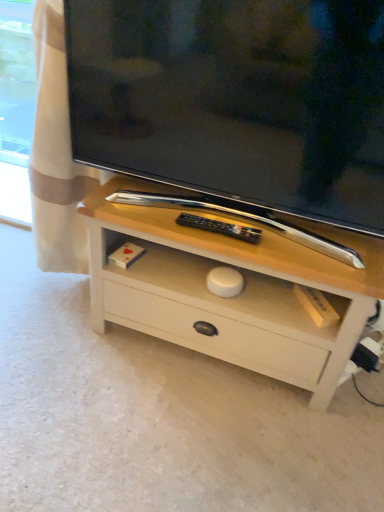
Locate an element on the screen. matte black tv at center is located at coordinates (236, 100).

In order to face matte black tv at center, should I rotate leftwards or rightwards?

To align with it, rotate right about 5.014°.

This screenshot has height=512, width=384. Describe the element at coordinates (236, 100) in the screenshot. I see `matte black tv at center` at that location.

Find the location of a particular element. This screenshot has width=384, height=512. white painted wood chest of drawers at center is located at coordinates (231, 298).

Describe the element at coordinates (231, 298) in the screenshot. I see `white painted wood chest of drawers at center` at that location.

Locate an element on the screen. matte black tv at center is located at coordinates (236, 100).

Which is more to the left, white painted wood chest of drawers at center or matte black tv at center?

matte black tv at center is more to the left.

Does white painted wood chest of drawers at center come behind matte black tv at center?

Yes, white painted wood chest of drawers at center is behind matte black tv at center.

Which point is more distant from viewer, (x=119, y=226) or (x=283, y=56)?

The point (x=119, y=226) is more distant.

From the image's perspective, is white painted wood chest of drawers at center below matte black tv at center?

Yes, from the image's perspective, white painted wood chest of drawers at center is below matte black tv at center.

From a real-world perspective, which is physically above, white painted wood chest of drawers at center or matte black tv at center?

In real-world perspective, matte black tv at center is above.

Can you confirm if white painted wood chest of drawers at center is thinner than matte black tv at center?

No, white painted wood chest of drawers at center is not thinner than matte black tv at center.

Between white painted wood chest of drawers at center and matte black tv at center, which one has less height?

white painted wood chest of drawers at center.

From the picture: Is white painted wood chest of drawers at center bigger or smaller than matte black tv at center?

Considering their sizes, white painted wood chest of drawers at center takes up more space than matte black tv at center.

Is matte black tv at center a part of white painted wood chest of drawers at center?

That's incorrect, matte black tv at center is not inside white painted wood chest of drawers at center.

Is white painted wood chest of drawers at center in contact with matte black tv at center?

white painted wood chest of drawers at center and matte black tv at center are not in contact.

Is white painted wood chest of drawers at center positioned with its back to matte black tv at center?

No.

What's the angular difference between white painted wood chest of drawers at center and matte black tv at center's facing directions?

white painted wood chest of drawers at center and matte black tv at center are facing 0.0016 degrees away from each other.

This screenshot has width=384, height=512. Find the location of `television above the white painted wood chest of drawers at center (from a real-world perspective)`. television above the white painted wood chest of drawers at center (from a real-world perspective) is located at coordinates (236, 100).

Looking at this image, which object is positioned more to the right, matte black tv at center or white painted wood chest of drawers at center?

From the viewer's perspective, white painted wood chest of drawers at center appears more on the right side.

Which object is closer to the camera taking this photo, matte black tv at center or white painted wood chest of drawers at center?

matte black tv at center.

Is point (177, 121) farther from camera compared to point (268, 283)?

No.

Consider the image. From the image's perspective, is matte black tv at center positioned above or below white painted wood chest of drawers at center?

From the image's perspective, matte black tv at center appears above white painted wood chest of drawers at center.

From a real-world perspective, relative to white painted wood chest of drawers at center, is matte black tv at center vertically above or below?

In terms of real-world spatial position, matte black tv at center is above white painted wood chest of drawers at center.

Considering the sizes of objects matte black tv at center and white painted wood chest of drawers at center in the image provided, who is thinner, matte black tv at center or white painted wood chest of drawers at center?

With smaller width is matte black tv at center.

Considering the relative sizes of matte black tv at center and white painted wood chest of drawers at center in the image provided, is matte black tv at center shorter than white painted wood chest of drawers at center?

No.

In terms of size, does matte black tv at center appear bigger or smaller than white painted wood chest of drawers at center?

Clearly, matte black tv at center is smaller in size than white painted wood chest of drawers at center.

Which is correct: matte black tv at center is inside white painted wood chest of drawers at center, or outside of it?

The correct answer is: outside.

Are matte black tv at center and white painted wood chest of drawers at center located far from each other?

No, matte black tv at center is in close proximity to white painted wood chest of drawers at center.

Is matte black tv at center oriented towards white painted wood chest of drawers at center?

No, matte black tv at center does not turn towards white painted wood chest of drawers at center.

Measure the distance from matte black tv at center to white painted wood chest of drawers at center.

They are 10.31 inches apart.

Identify the location of television in front of the white painted wood chest of drawers at center. The height and width of the screenshot is (512, 384). (236, 100).

Identify the location of television on the left of white painted wood chest of drawers at center. The width and height of the screenshot is (384, 512). (236, 100).

Find the location of a particular element. This screenshot has width=384, height=512. television above the white painted wood chest of drawers at center (from a real-world perspective) is located at coordinates (236, 100).